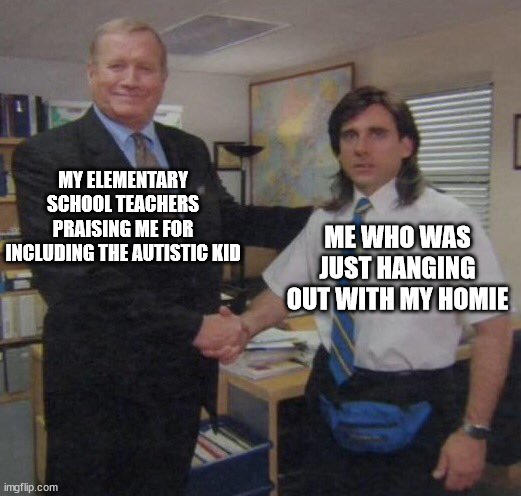
Identify the location of paper stack. Image resolution: width=521 pixels, height=496 pixels. (277, 352).